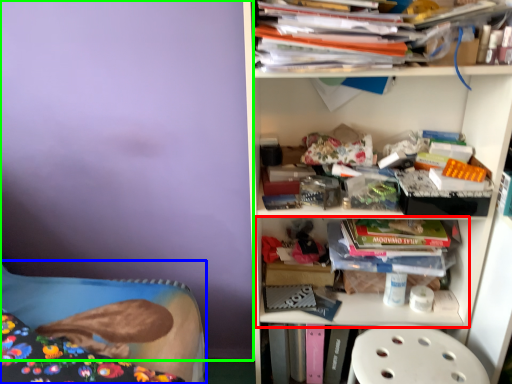
Question: Considering the real-world distances, which object is farthest from shelf (highlighted by a red box)? bed (highlighted by a blue box) or backdrop (highlighted by a green box)?

Choices:
 (A) bed
 (B) backdrop

Answer: (B)